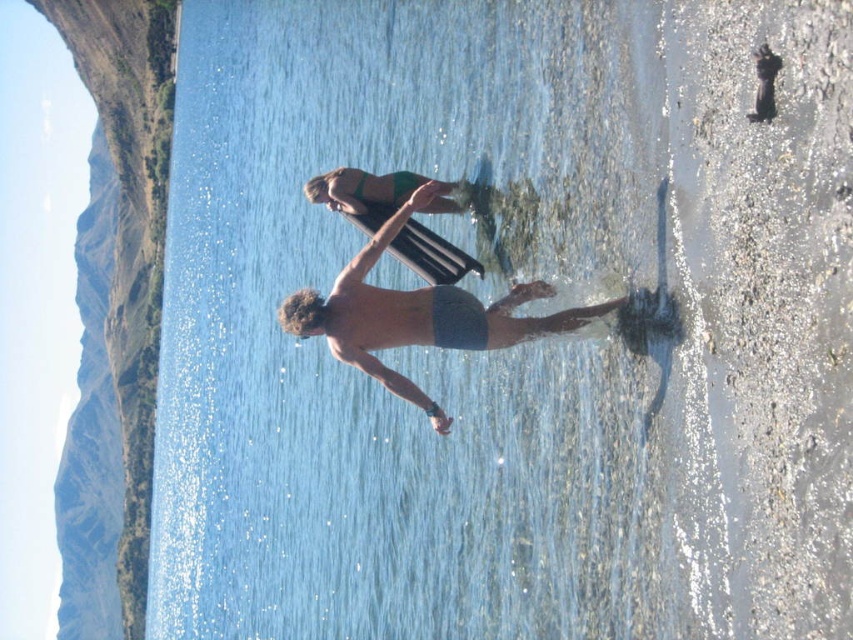
Looking at this image, you are a hiker who wants to cross from the rocky cliff at left to the gray fabric shorts at center. Do you think you can make the jump? Explain your reasoning.

The rocky cliff at left is 938.97 feet from the gray fabric shorts at center. Since this distance is extremely large, it is impossible to jump that far. You should find another way to cross.

You are standing on the beach and see the rocky cliff at left and the gray fabric shorts at center. Which object is closer to your left side?

The rocky cliff at left is closer to your left side because it is positioned to the left of the gray fabric shorts at center.

You are a photographer standing at the beach and want to capture a photo of the gray fabric shorts at center without the rocky cliff at left appearing in the frame. How should you adjust your camera angle?

The rocky cliff at left is above the gray fabric shorts at center, so to avoid including the cliff in the frame, you should lower your camera angle to focus on the lower area where the gray fabric shorts at center are located.